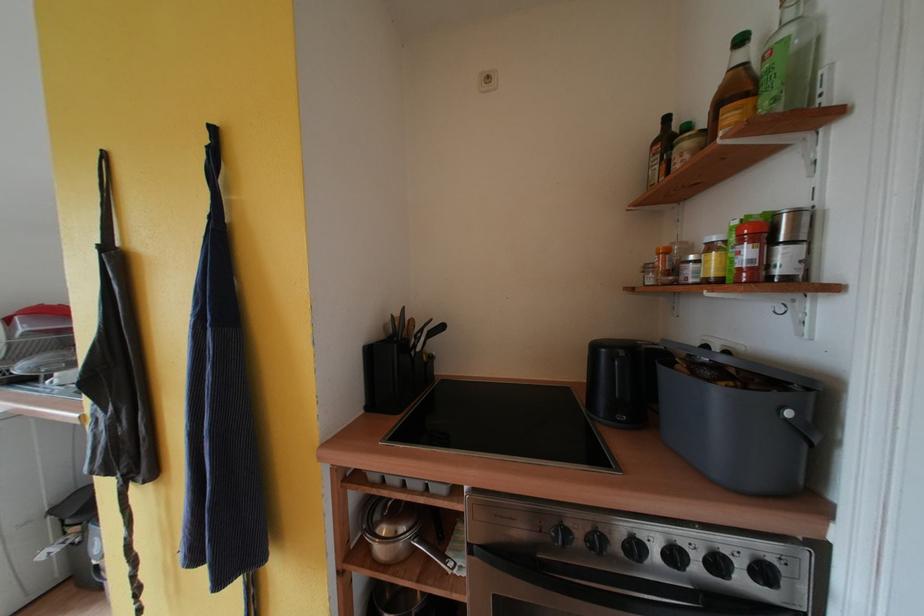
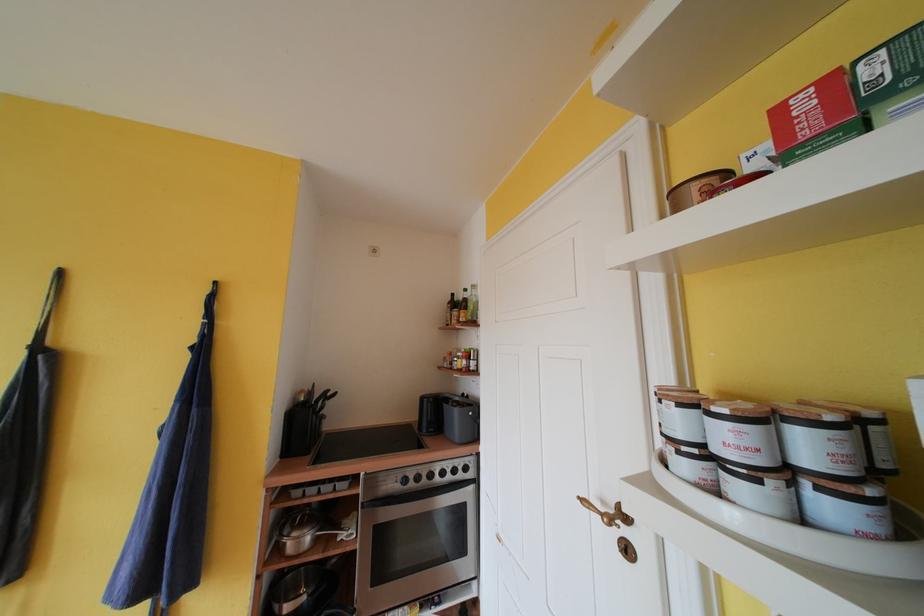
Where in the second image is the point corresponding to point 574,528 from the first image?

(412, 477)